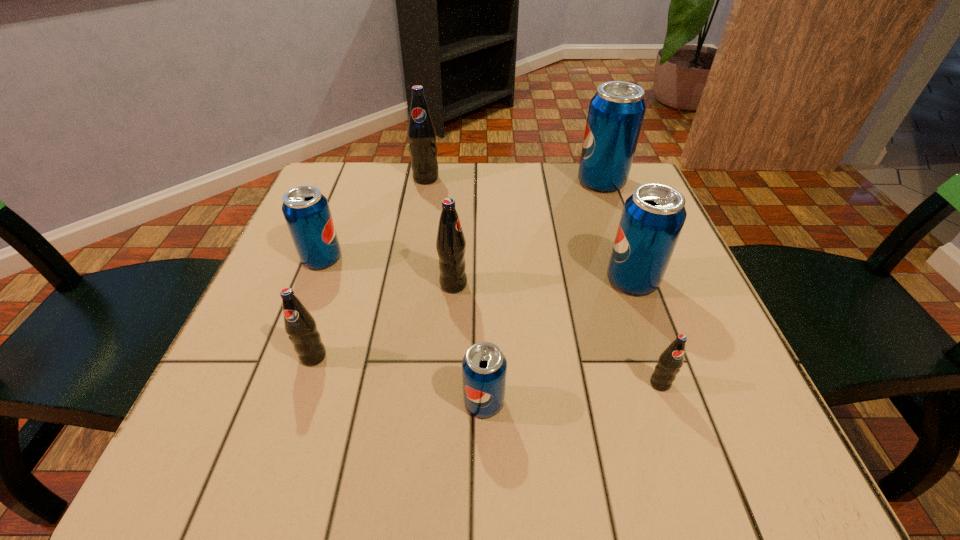
Image resolution: width=960 pixels, height=540 pixels. What are the coordinates of `free space between the third nearest pop and the third pop from left to right` in the screenshot? It's located at (370, 268).

Locate an element on the screen. The image size is (960, 540). vacant space in between the leftmost black pop and the second biggest blue pop soda is located at coordinates (473, 318).

Image resolution: width=960 pixels, height=540 pixels. I want to click on vacant area that lies between the second nearest black pop and the second biggest black pop, so click(383, 321).

At what (x,y) coordinates should I click in order to perform the action: click on free spot between the nearest black pop and the second blue pop soda from left to right. Please return your answer as a coordinate pair (x, y). Looking at the image, I should click on (572, 393).

The image size is (960, 540). What are the coordinates of `free point between the smallest black pop and the second farthest black pop` in the screenshot? It's located at (557, 334).

What are the coordinates of `vacant area that lies between the second biggest black pop and the leftmost black pop` in the screenshot? It's located at (383, 321).

You are a GUI agent. You are given a task and a screenshot of the screen. Output one action in this format:
    pyautogui.click(x=<x>, y=<y>)
    Task: Click on the empty location between the second biggest black pop and the third blue pop soda from right to left
    The image size is (960, 540).
    Given the screenshot: What is the action you would take?
    pyautogui.click(x=468, y=343)

Image resolution: width=960 pixels, height=540 pixels. Identify the location of vacant area that lies between the third smallest blue pop soda and the smallest black pop. (x=646, y=332).

You are a GUI agent. You are given a task and a screenshot of the screen. Output one action in this format:
    pyautogui.click(x=<x>, y=<y>)
    Task: Click on the object that can be found as the third closest to the second farthest black pop
    
    Given the screenshot: What is the action you would take?
    pyautogui.click(x=301, y=327)

Point out which object is positioned as the fourth nearest to the third black pop from right to left. Please provide its 2D coordinates. Your answer should be formatted as a tuple, i.e. [(x, y)], where the tuple contains the x and y coordinates of a point satisfying the conditions above.

[(652, 219)]